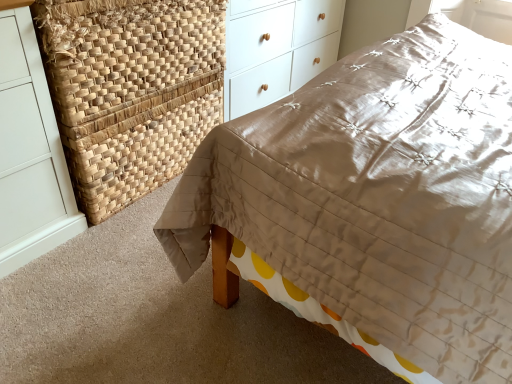
Question: Looking at the image, does white wood chest of drawers at upper center seem bigger or smaller compared to matte brown quilt at center?

Choices:
 (A) big
 (B) small

Answer: (B)

Question: From a real-world perspective, relative to matte brown quilt at center, is white wood chest of drawers at upper center vertically above or below?

Choices:
 (A) below
 (B) above

Answer: (A)

Question: Based on their relative distances, which object is nearer to the matte brown quilt at center?

Choices:
 (A) natural woven basket at upper left
 (B) white wood chest of drawers at upper center

Answer: (A)

Question: Based on their relative distances, which object is nearer to the matte brown quilt at center?

Choices:
 (A) white wood chest of drawers at upper center
 (B) natural woven basket at upper left

Answer: (B)